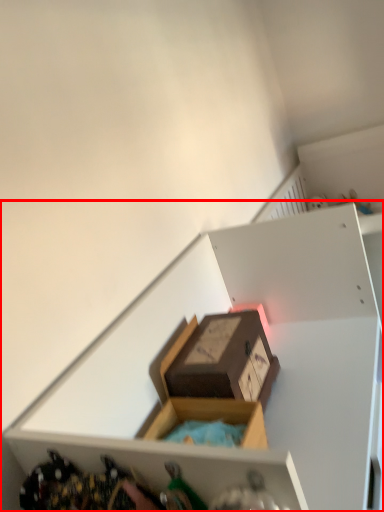
Question: From the image's perspective, considering the relative positions of shelf (annotated by the red box) and box in the image provided, where is shelf (annotated by the red box) located with respect to the staircase?

Choices:
 (A) above
 (B) below

Answer: (B)